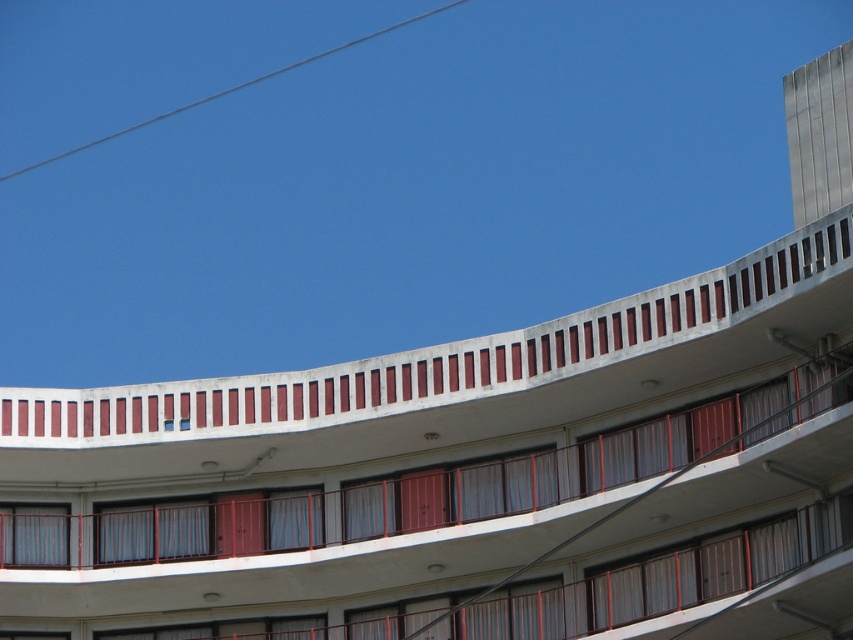
Can you confirm if white concrete balcony at upper center is positioned to the right of gray wire at upper left?

Yes, white concrete balcony at upper center is to the right of gray wire at upper left.

Can you confirm if white concrete balcony at upper center is shorter than gray wire at upper left?

Yes, white concrete balcony at upper center is shorter than gray wire at upper left.

Find the location of a particular element. white concrete balcony at upper center is located at coordinates (466, 481).